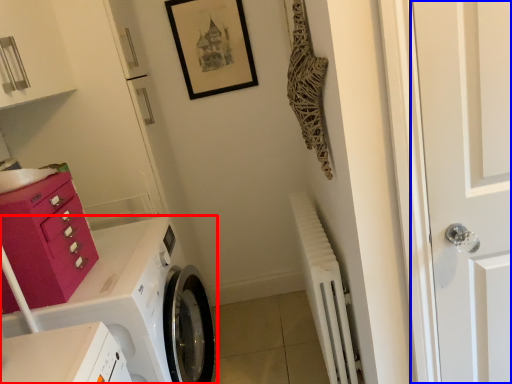
Question: Among these objects, which one is farthest to the camera, washing machine (highlighted by a red box) or door (highlighted by a blue box)?

Choices:
 (A) washing machine
 (B) door

Answer: (A)